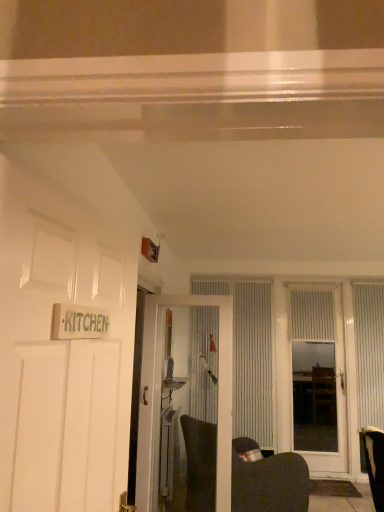
Question: Considering the positions of point (380, 359) and point (59, 254), is point (380, 359) closer or farther from the camera than point (59, 254)?

Choices:
 (A) closer
 (B) farther

Answer: (B)

Question: Is white textured curtain at right, arranged as the third curtain when viewed from the left, taller or shorter than white glossy door at left, which is the third door in right-to-left order?

Choices:
 (A) tall
 (B) short

Answer: (A)

Question: Which object is the closest to the white glossy door at left, the 1th door viewed from the front?

Choices:
 (A) white textured curtain at upper right, placed as the 2th curtain when sorted from right to left
 (B) white textured door at center, which is counted as the 1th door, starting from the back
 (C) dark gray fabric swivel chair at lower center
 (D) white textured door at center, the second door viewed from the back
 (E) white textured curtain at right, the first curtain in the right-to-left sequence

Answer: (D)

Question: Estimate the real-world distances between objects in this image. Which object is closer to the white textured curtain at right, the first curtain in the right-to-left sequence?

Choices:
 (A) white textured curtain at upper right, arranged as the 2th curtain when viewed from the left
 (B) dark gray fabric swivel chair at lower center
 (C) white glossy door at left, the 3th door viewed from the back
 (D) white textured door at center, which is the second door in left-to-right order
 (E) white textured curtain at center, which ranks as the third curtain in right-to-left order

Answer: (A)